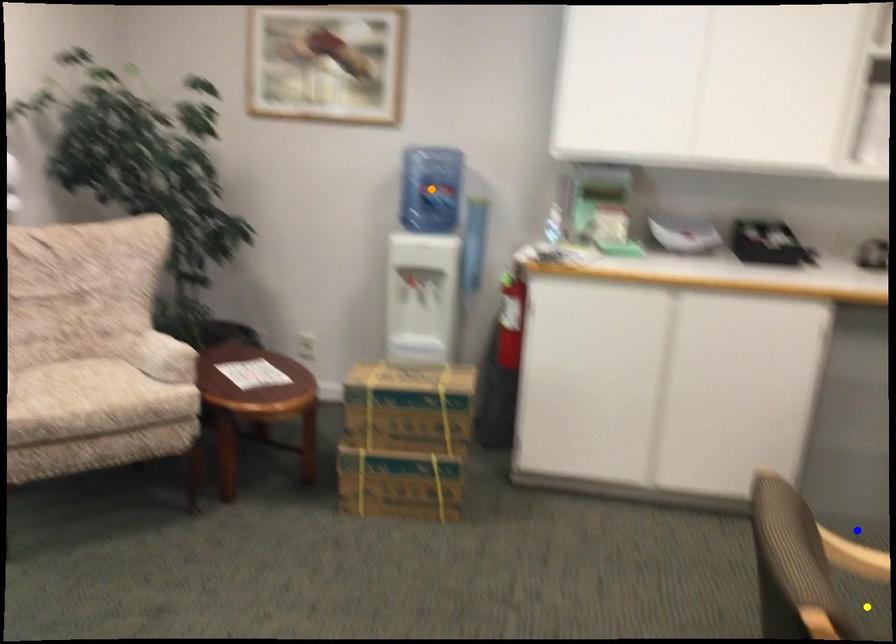
Order these from farthest to nearest:
- blue point
- yellow point
- orange point

orange point → blue point → yellow point